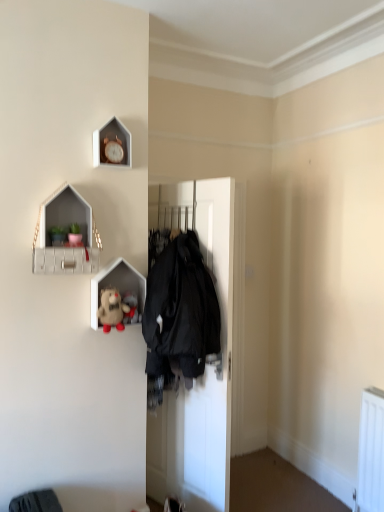
Question: From the image's perspective, is fluffy beige teddy bear at upper left, which is the first toy in front-to-back order, positioned above or below black matte coat hanger at center?

Choices:
 (A) above
 (B) below

Answer: (A)

Question: Would you say fluffy beige teddy bear at upper left, the 2th toy from the back, is inside or outside black matte coat hanger at center?

Choices:
 (A) inside
 (B) outside

Answer: (B)

Question: Estimate the real-world distances between objects in this image. Which object is closer to the wooden clock at upper center?

Choices:
 (A) black matte coat hanger at center
 (B) matte white shelf at upper left, which is the 2th shelf in bottom-to-top order
 (C) matte white plush toy at center, positioned as the first shelf in bottom-to-top order
 (D) fluffy fabric stuffed animal at center, which is the 2th toy from front to back
 (E) fluffy beige teddy bear at upper left, which is the first toy in front-to-back order

Answer: (B)

Question: Estimate the real-world distances between objects in this image. Which object is farther from the fluffy fabric stuffed animal at center, which is the 2th toy from front to back?

Choices:
 (A) fluffy beige teddy bear at upper left, which is the first toy in front-to-back order
 (B) matte white plush toy at center, placed as the second shelf when sorted from top to bottom
 (C) matte white shelf at upper left, which is the 2th shelf in bottom-to-top order
 (D) black matte coat hanger at center
 (E) wooden clock at upper center

Answer: (E)